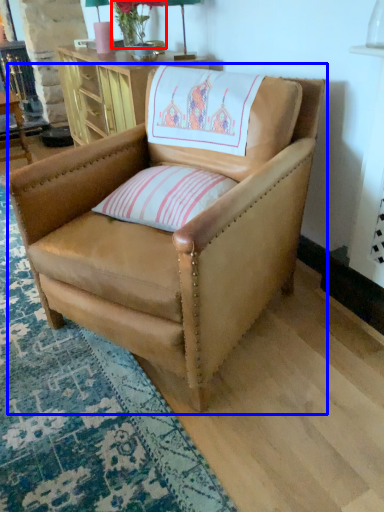
Question: Which of the following is the farthest to the observer, flower (highlighted by a red box) or chair (highlighted by a blue box)?

Choices:
 (A) flower
 (B) chair

Answer: (A)